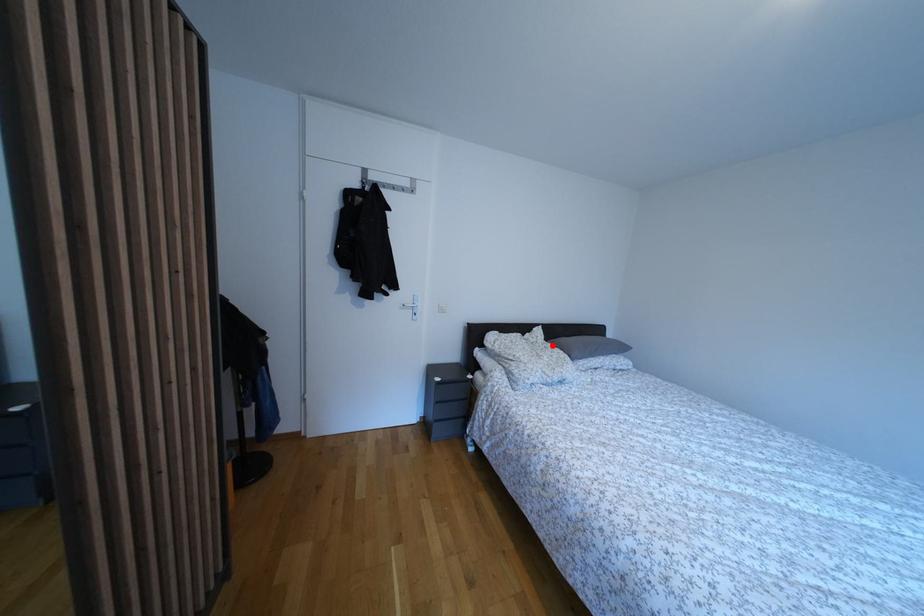
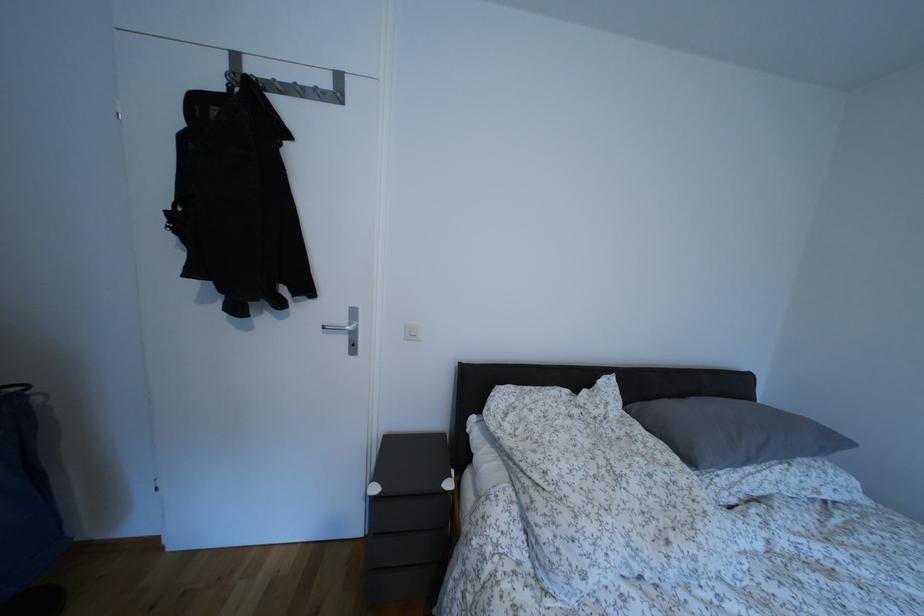
Find the pixel in the second image that matches the highlighted location in the first image.

(633, 415)